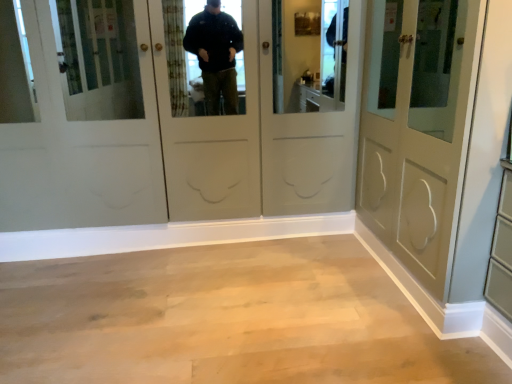
In order to face matte gray door at right, should I rotate leftwards or rightwards?

To align with it, rotate right about 25.601°.

At what (x,y) coordinates should I click in order to perform the action: click on matte gray door at right. Please return your answer as a coordinate pair (x, y). The width and height of the screenshot is (512, 384). Looking at the image, I should click on (417, 127).

Measure the distance between point (465, 8) and camera.

The depth of point (465, 8) is 1.44 meters.

What do you see at coordinates (417, 127) in the screenshot?
I see `matte gray door at right` at bounding box center [417, 127].

What are the coordinates of `light wood floor at center` in the screenshot? It's located at (225, 319).

Describe the element at coordinates (225, 319) in the screenshot. This screenshot has width=512, height=384. I see `light wood floor at center` at that location.

Locate an element on the screen. This screenshot has width=512, height=384. matte gray door at right is located at coordinates (417, 127).

Is matte gray door at right at the right side of light wood floor at center?

Yes, matte gray door at right is to the right of light wood floor at center.

Considering their positions, is matte gray door at right located in front of or behind light wood floor at center?

Visually, matte gray door at right is located in front of light wood floor at center.

Is point (456, 8) less distant than point (56, 369)?

That is True.

From the image's perspective, is matte gray door at right located beneath light wood floor at center?

No, from the image's perspective, matte gray door at right is not below light wood floor at center.

From a real-world perspective, which is physically below, matte gray door at right or light wood floor at center?

light wood floor at center is physically lower.

Considering the sizes of matte gray door at right and light wood floor at center in the image, is matte gray door at right wider or thinner than light wood floor at center?

Clearly, matte gray door at right has less width compared to light wood floor at center.

Can you confirm if matte gray door at right is shorter than light wood floor at center?

No.

Which of these two, matte gray door at right or light wood floor at center, is smaller?

light wood floor at center is smaller.

Is matte gray door at right completely or partially outside of light wood floor at center?

Yes, matte gray door at right is not within light wood floor at center.

Is matte gray door at right in contact with light wood floor at center?

No, matte gray door at right is not touching light wood floor at center.

Looking at this image, is matte gray door at right positioned with its back to light wood floor at center?

matte gray door at right is not turned away from light wood floor at center.

You are a GUI agent. You are given a task and a screenshot of the screen. Output one action in this format:
    pyautogui.click(x=<x>, y=<y>)
    Task: Click on the corridor directly beneath the matte gray door at right (from a real-world perspective)
    
    Given the screenshot: What is the action you would take?
    pyautogui.click(x=225, y=319)

Is light wood floor at center to the right of matte gray door at right from the viewer's perspective?

Incorrect, light wood floor at center is not on the right side of matte gray door at right.

Does light wood floor at center come behind matte gray door at right?

Yes, it is behind matte gray door at right.

Considering the points (364, 376) and (407, 144), which point is behind, point (364, 376) or point (407, 144)?

The point (407, 144) is behind.

From the image's perspective, between light wood floor at center and matte gray door at right, who is located below?

From the image's view, light wood floor at center is below.

From a real-world perspective, which is physically above, light wood floor at center or matte gray door at right?

matte gray door at right.

Which of these two, light wood floor at center or matte gray door at right, is wider?

light wood floor at center.

Considering the relative sizes of light wood floor at center and matte gray door at right in the image provided, is light wood floor at center shorter than matte gray door at right?

Yes, light wood floor at center is shorter than matte gray door at right.

Looking at the image, does light wood floor at center seem bigger or smaller compared to matte gray door at right?

In the image, light wood floor at center appears to be smaller than matte gray door at right.

Would you say light wood floor at center contains matte gray door at right?

Actually, matte gray door at right is outside light wood floor at center.

Would you consider light wood floor at center to be distant from matte gray door at right?

No, light wood floor at center is not far away from matte gray door at right.

From the picture: Is light wood floor at center oriented away from matte gray door at right?

No, light wood floor at center's orientation is not away from matte gray door at right.

From the picture: What's the angular difference between light wood floor at center and matte gray door at right's facing directions?

The angular difference between light wood floor at center and matte gray door at right is 0.768 degrees.

Measure the distance between light wood floor at center and matte gray door at right.

light wood floor at center and matte gray door at right are 87.17 centimeters apart.

At what (x,y) coordinates should I click in order to perform the action: click on corridor behind the matte gray door at right. Please return your answer as a coordinate pair (x, y). This screenshot has height=384, width=512. Looking at the image, I should click on (225, 319).

This screenshot has width=512, height=384. I want to click on corridor directly beneath the matte gray door at right (from a real-world perspective), so click(x=225, y=319).

Where is `corridor on the left of matte gray door at right`? The width and height of the screenshot is (512, 384). corridor on the left of matte gray door at right is located at coordinates (225, 319).